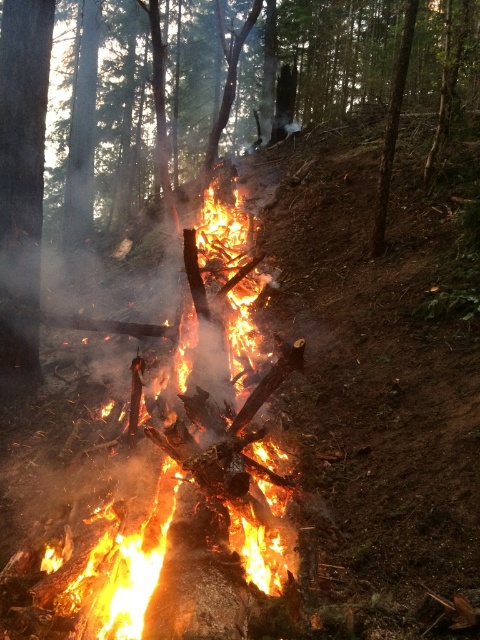
Which is above, flaming wood at center or smooth bark tree at left?

Positioned higher is smooth bark tree at left.

Which is in front, point (160, 545) or point (39, 257)?

Point (160, 545)

Image resolution: width=480 pixels, height=640 pixels. I want to click on flaming wood at center, so click(196, 464).

Is point (414, 44) farther from viewer compared to point (20, 161)?

Yes, point (414, 44) is farther from viewer.

At what (x,y) coordinates should I click in order to perform the action: click on charcoal wood fire at center. Please return your answer as a coordinate pair (x, y). The image size is (480, 640). Looking at the image, I should click on (337, 52).

This screenshot has width=480, height=640. What do you see at coordinates (196, 464) in the screenshot? I see `flaming wood at center` at bounding box center [196, 464].

Who is more distant from viewer, (231, 531) or (395, 58)?

The point (395, 58) is more distant.

Find the location of a particular element. flaming wood at center is located at coordinates (196, 464).